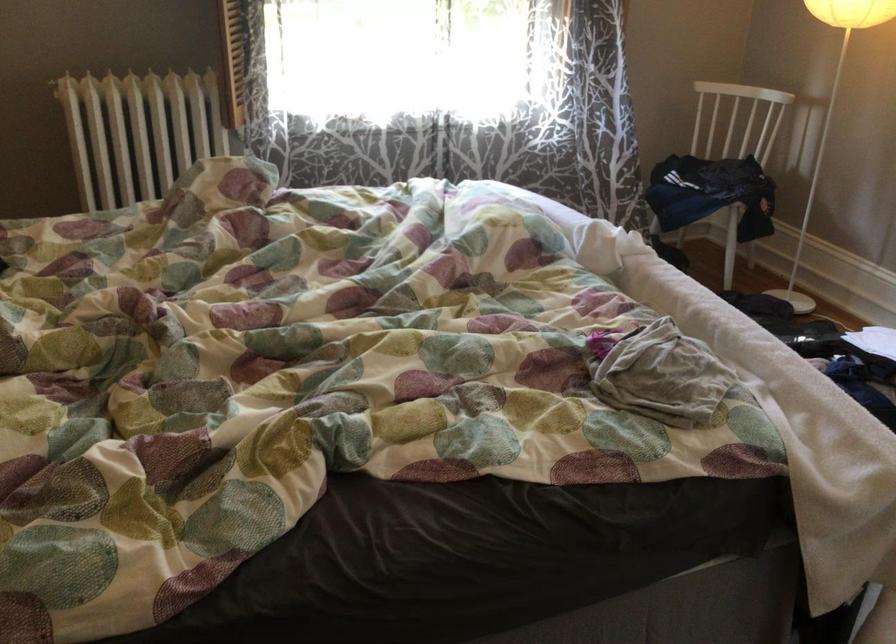
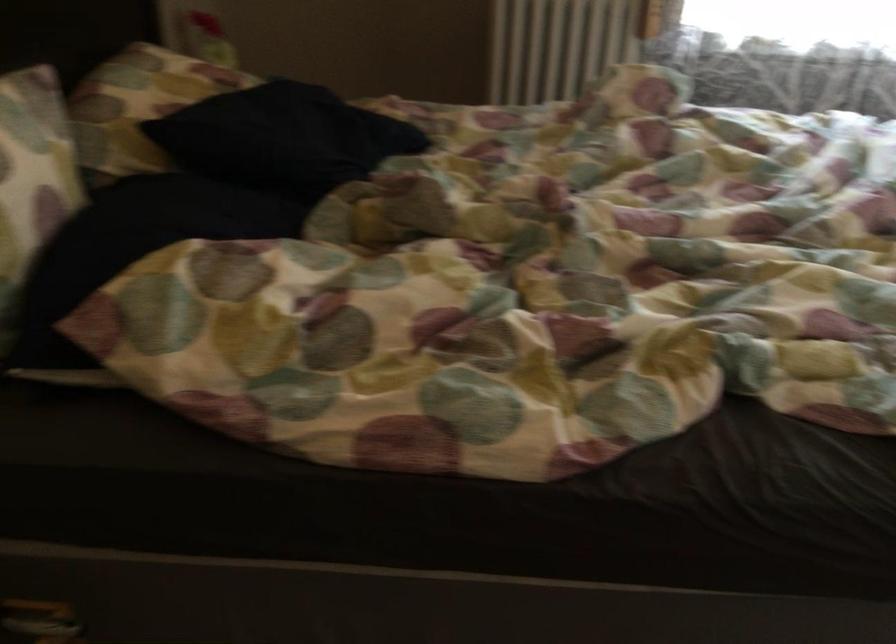
Question: How did the camera likely rotate?

Choices:
 (A) Left
 (B) Right
 (C) Up
 (D) Down

Answer: (A)